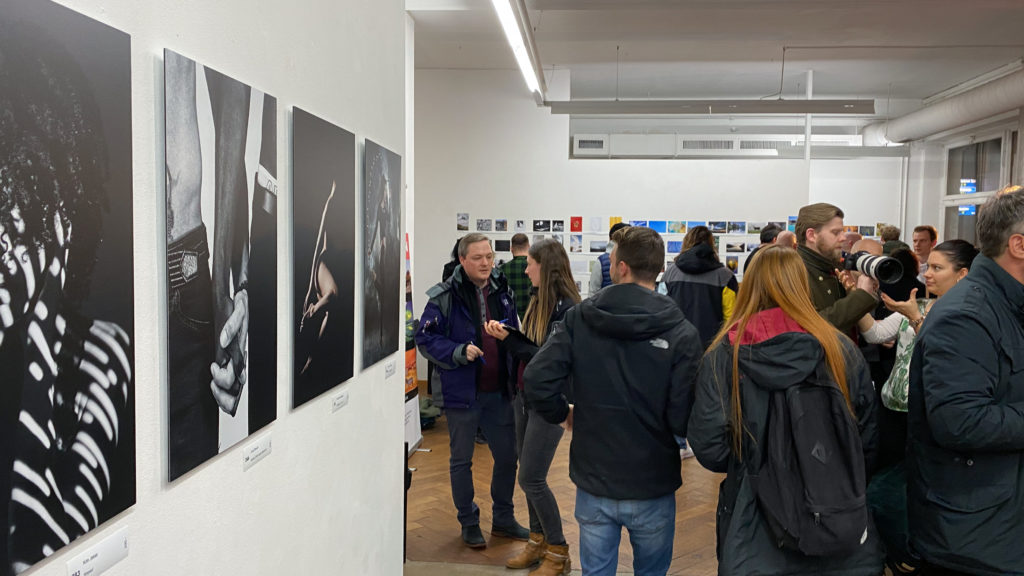
At what (x,y) coordinates should I click in order to perform the action: click on ceiling. Please return your answer as a coordinate pair (x, y). This screenshot has height=576, width=1024. Looking at the image, I should click on (621, 9), (886, 10).